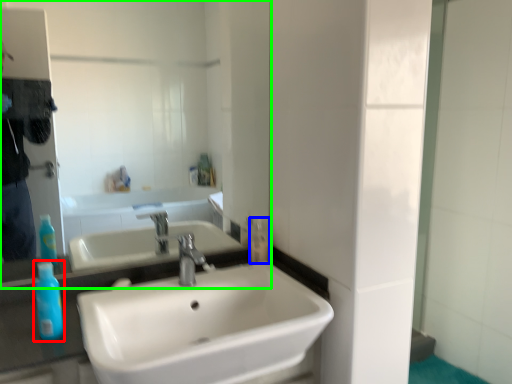
Question: Based on their relative distances, which object is farther from mouthwash (highlighted by a red box)? Choose from mouthwash (highlighted by a blue box) and mirror (highlighted by a green box).

Choices:
 (A) mouthwash
 (B) mirror

Answer: (B)